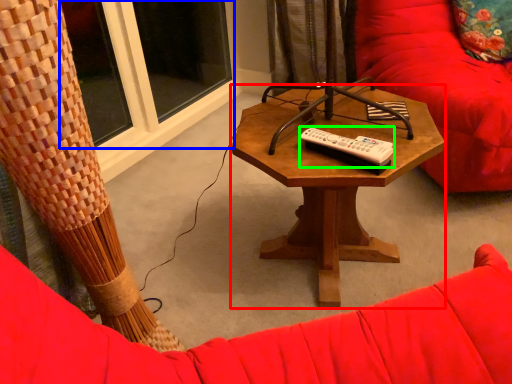
Question: Which is farther away from coffee table (highlighted by a red box)? window (highlighted by a blue box) or remote (highlighted by a green box)?

Choices:
 (A) window
 (B) remote

Answer: (A)